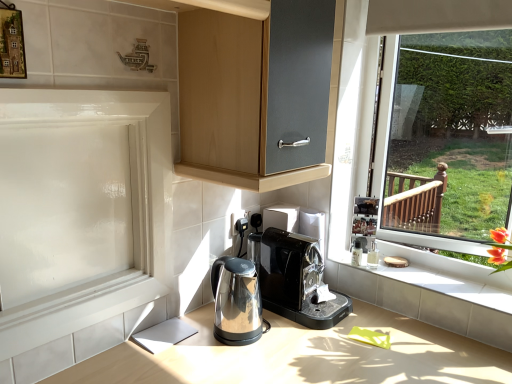
You are a GUI agent. You are given a task and a screenshot of the screen. Output one action in this format:
    pyautogui.click(x=<x>, y=<y>)
    Task: Click on the free spot above white tile at lower right (from a real-world perspective)
    The height and width of the screenshot is (384, 512).
    Given the screenshot: What is the action you would take?
    click(x=424, y=278)